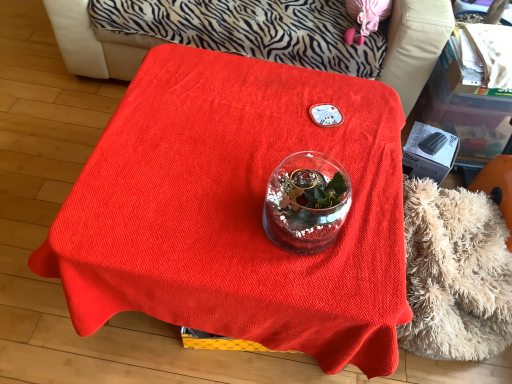
I want to click on vacant area located to the right-hand side of transparent glass vase at center, so click(x=375, y=229).